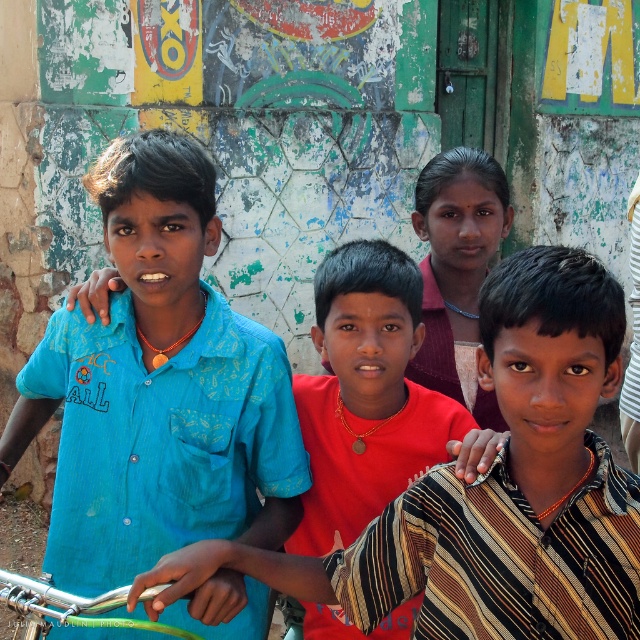
Between point (92, 182) and point (28, 612), which one is positioned behind?

The point (92, 182) is behind.

Who is positioned more to the left, blue cotton shirt at left or green rubber handlebars at lower left?

Positioned to the left is blue cotton shirt at left.

Between point (196, 307) and point (76, 609), which one is positioned behind?

Positioned behind is point (196, 307).

Find the location of `blue cotton shirt at left`. blue cotton shirt at left is located at coordinates tap(157, 388).

Is red matte shirt at center taller than matte pink shirt at center?

Yes, red matte shirt at center is taller than matte pink shirt at center.

Is point (372, 333) positioned in front of point (500, 424)?

Yes, it is in front of point (500, 424).

Measure the distance between red matte shirt at center and camera.

The distance of red matte shirt at center from camera is 3.34 meters.

The image size is (640, 640). Identify the location of red matte shirt at center. (365, 396).

Describe the element at coordinates (365, 396) in the screenshot. This screenshot has width=640, height=640. I see `red matte shirt at center` at that location.

Looking at this image, is red matte shirt at center positioned behind green rubber handlebars at lower left?

→ Yes, red matte shirt at center is behind green rubber handlebars at lower left.

Image resolution: width=640 pixels, height=640 pixels. What are the coordinates of `red matte shirt at center` in the screenshot? It's located at (365, 396).

Where is `red matte shirt at center`? The image size is (640, 640). red matte shirt at center is located at coordinates (365, 396).